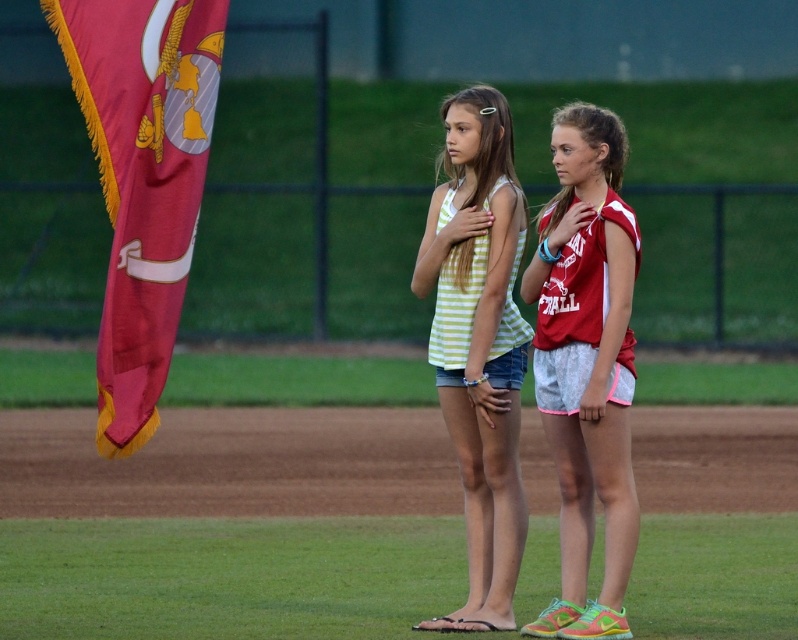
Question: Is red jersey shorts at center thinner than striped fabric tank top at center?

Choices:
 (A) yes
 (B) no

Answer: (A)

Question: Is red jersey shorts at center to the right of striped fabric tank top at center from the viewer's perspective?

Choices:
 (A) no
 (B) yes

Answer: (B)

Question: Which of these objects is positioned closest to the red fabric flag at left?

Choices:
 (A) red jersey shorts at center
 (B) striped fabric tank top at center

Answer: (B)

Question: Is red jersey shorts at center wider than striped fabric tank top at center?

Choices:
 (A) yes
 (B) no

Answer: (B)

Question: Which of the following is the closest to the observer?

Choices:
 (A) red jersey shorts at center
 (B) striped fabric tank top at center
 (C) red fabric flag at left

Answer: (C)

Question: Which is farther from the red fabric flag at left?

Choices:
 (A) striped fabric tank top at center
 (B) red jersey shorts at center

Answer: (B)